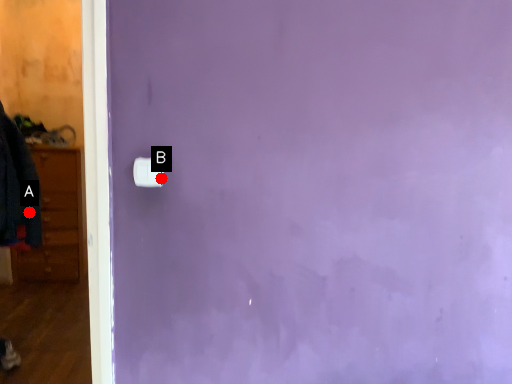
Question: Two points are circled on the image, labeled by A and B beside each circle. Which of the following is the farthest from the observer?

Choices:
 (A) A is further
 (B) B is further

Answer: (A)